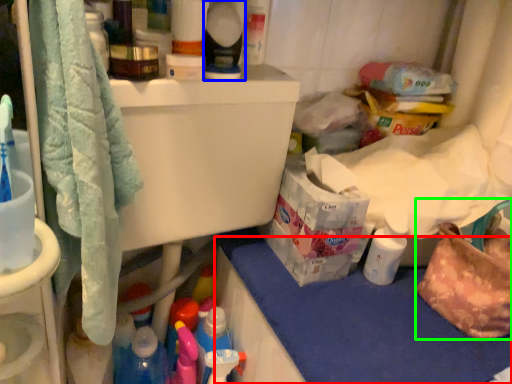
Question: Estimate the real-world distances between objects in this image. Which object is closer to counter top (highlighted by a red box), cleaning product (highlighted by a blue box) or handbag (highlighted by a green box)?

Choices:
 (A) cleaning product
 (B) handbag

Answer: (B)